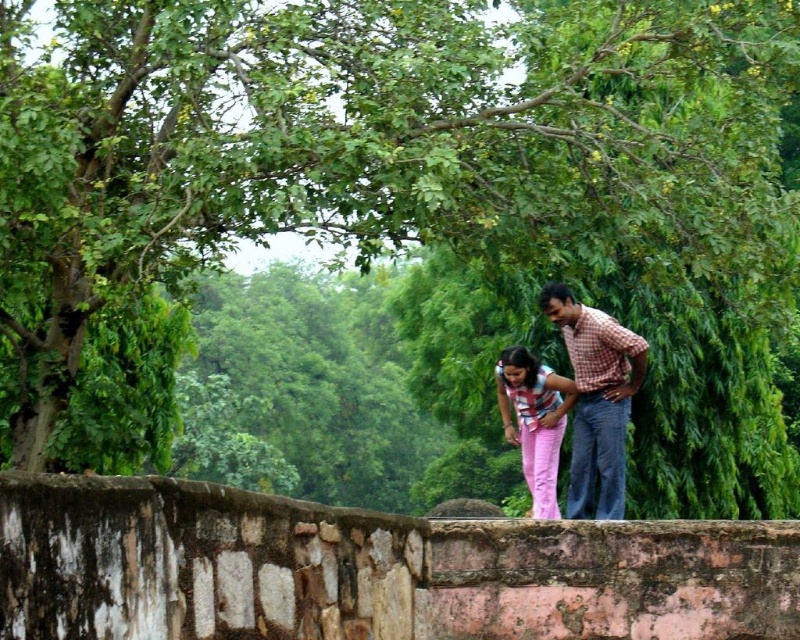
Question: Is checkered fabric shirt at center behind striped fabric shirt at center?

Choices:
 (A) no
 (B) yes

Answer: (A)

Question: Is checkered fabric shirt at center positioned behind striped fabric shirt at center?

Choices:
 (A) yes
 (B) no

Answer: (B)

Question: Is checkered fabric shirt at center thinner than striped fabric shirt at center?

Choices:
 (A) no
 (B) yes

Answer: (A)

Question: Which point is closer to the camera?

Choices:
 (A) striped fabric shirt at center
 (B) checkered fabric shirt at center

Answer: (B)

Question: Which point is farther to the camera?

Choices:
 (A) (545, 509)
 (B) (606, 426)

Answer: (A)